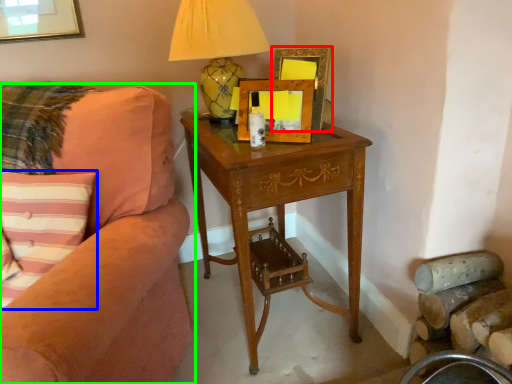
Question: Which object is positioned farthest from picture frame (highlighted by a red box)? Select from pillow (highlighted by a blue box) and studio couch (highlighted by a green box).

Choices:
 (A) pillow
 (B) studio couch

Answer: (A)